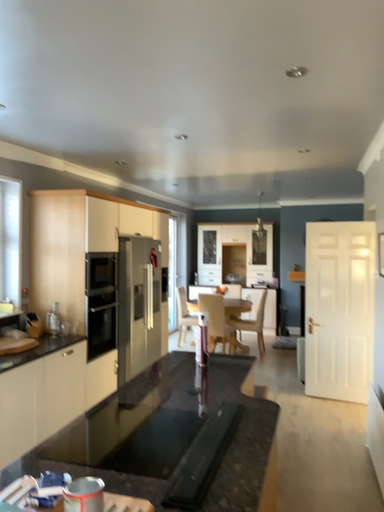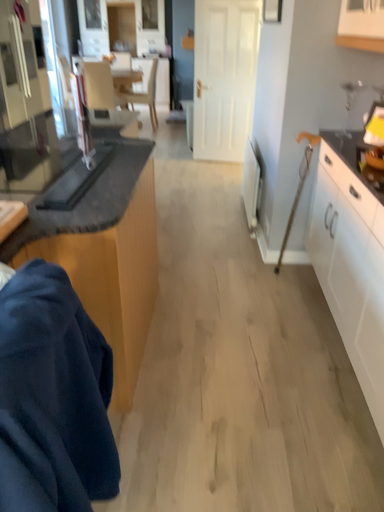
Question: How did the camera likely rotate when shooting the video?

Choices:
 (A) rotated downward
 (B) rotated upward

Answer: (A)